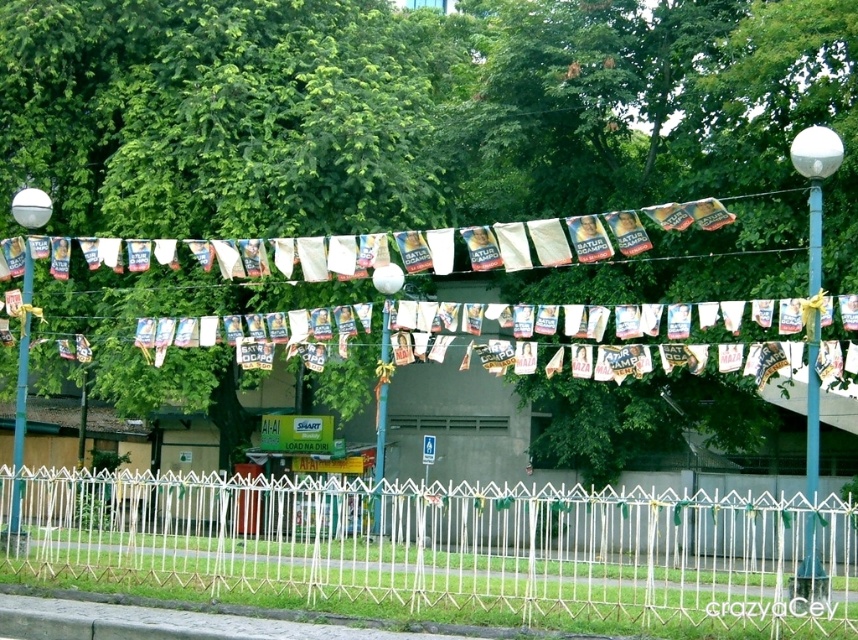
You are a painter who needs to know the relative widths of the objects to choose the right amount of paint. Based on the scene, which object, the white bamboo fence at lower center or the blue metallic pole at right, is wider?

The white bamboo fence at lower center might be wider than blue metallic pole at right according to the description.

You are standing at the entrance of the festive area and want to walk towards the building in the background. Which object will you pass first, the white bamboo fence at lower center or the blue metallic pole at right?

You will pass the white bamboo fence at lower center first because it is in front of the blue metallic pole at right, making it closer to your starting position at the entrance.